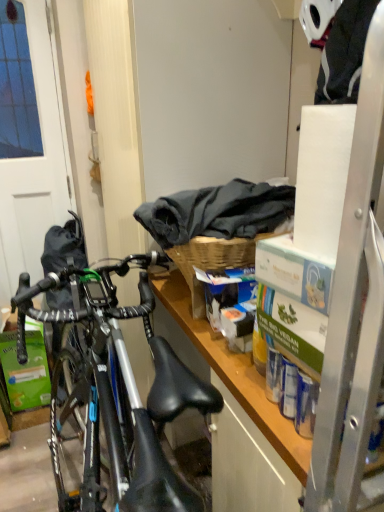
Question: Are woven wood picnic basket at center and dark gray fabric at upper center far apart?

Choices:
 (A) no
 (B) yes

Answer: (A)

Question: Is dark gray fabric at upper center a part of woven wood picnic basket at center?

Choices:
 (A) no
 (B) yes

Answer: (A)

Question: From a real-world perspective, is woven wood picnic basket at center on top of dark gray fabric at upper center?

Choices:
 (A) no
 (B) yes

Answer: (A)

Question: Can you confirm if woven wood picnic basket at center is smaller than dark gray fabric at upper center?

Choices:
 (A) yes
 (B) no

Answer: (A)

Question: From the image's perspective, is woven wood picnic basket at center located above dark gray fabric at upper center?

Choices:
 (A) yes
 (B) no

Answer: (B)

Question: Based on their positions, is woven wood picnic basket at center located to the left or right of matte white screen door at left?

Choices:
 (A) left
 (B) right

Answer: (B)

Question: Looking at their shapes, would you say woven wood picnic basket at center is wider or thinner than matte white screen door at left?

Choices:
 (A) thin
 (B) wide

Answer: (B)

Question: In terms of height, does woven wood picnic basket at center look taller or shorter compared to matte white screen door at left?

Choices:
 (A) tall
 (B) short

Answer: (B)

Question: From a real-world perspective, relative to matte white screen door at left, is woven wood picnic basket at center vertically above or below?

Choices:
 (A) above
 (B) below

Answer: (A)

Question: Looking at their shapes, would you say green cardboard box at lower left is wider or thinner than wooden shelf at center?

Choices:
 (A) wide
 (B) thin

Answer: (B)

Question: Considering the positions of green cardboard box at lower left and wooden shelf at center in the image, is green cardboard box at lower left taller or shorter than wooden shelf at center?

Choices:
 (A) tall
 (B) short

Answer: (B)

Question: Does point click(x=8, y=372) appear closer or farther from the camera than point click(x=264, y=421)?

Choices:
 (A) farther
 (B) closer

Answer: (A)

Question: Is green cardboard box at lower left inside or outside of wooden shelf at center?

Choices:
 (A) inside
 (B) outside

Answer: (B)

Question: In terms of size, does matte white screen door at left appear bigger or smaller than woven wood picnic basket at center?

Choices:
 (A) small
 (B) big

Answer: (B)

Question: Is matte white screen door at left wider or thinner than woven wood picnic basket at center?

Choices:
 (A) thin
 (B) wide

Answer: (A)